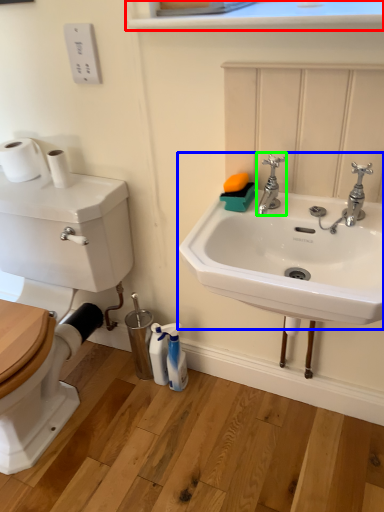
Question: Which object is positioned farthest from window sill (highlighted by a red box)? Select from sink (highlighted by a blue box) and tap (highlighted by a green box).

Choices:
 (A) sink
 (B) tap

Answer: (A)